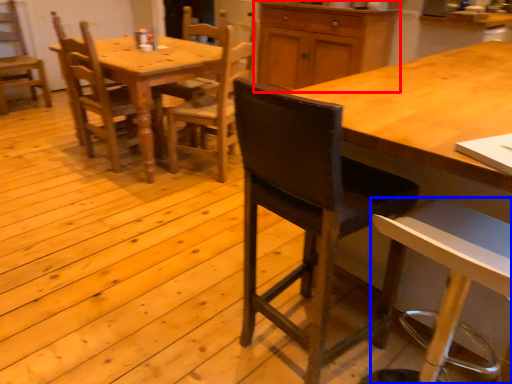
Question: Which point is closer to the camera, cabinetry (highlighted by a red box) or chair (highlighted by a blue box)?

Choices:
 (A) cabinetry
 (B) chair

Answer: (B)